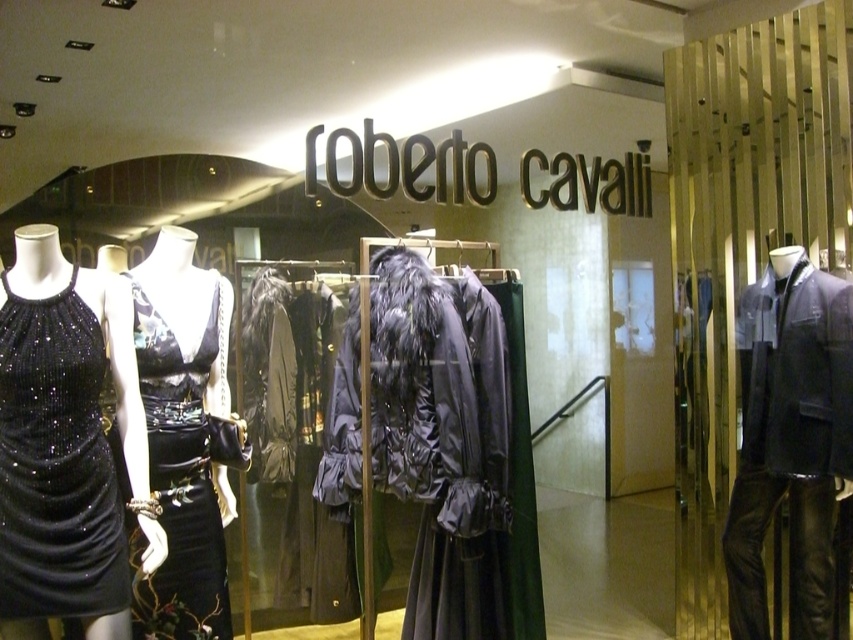
You are a customer in the Roberto Cavalli boutique and want to move from the entrance to the dark blue leather jacket at right. There is a black sequined dress at left blocking your path. Can you walk around it without touching the dress?

The distance between dark blue leather jacket at right and black sequined dress at left is 2.53 meters, so yes, you can walk around the black sequined dress at left without touching it since there is enough space between them.

You are a customer in the Roberto Cavalli boutique and want to see the black sequined dress at left. However, the dark blue leather jacket at right is blocking your view. Can you move the jacket to get a better look at the dress?

The black sequined dress at left is behind the dark blue leather jacket at right, so moving the jacket would allow you to see the dress more clearly.

You are a customer in the Roberto Cavalli boutique and want to know which dress is shorter between the black sequined dress at left and the black satin dress at center. Can you tell me?

The black sequined dress at left is not as tall as the black satin dress at center, so the black sequined dress at left is shorter.